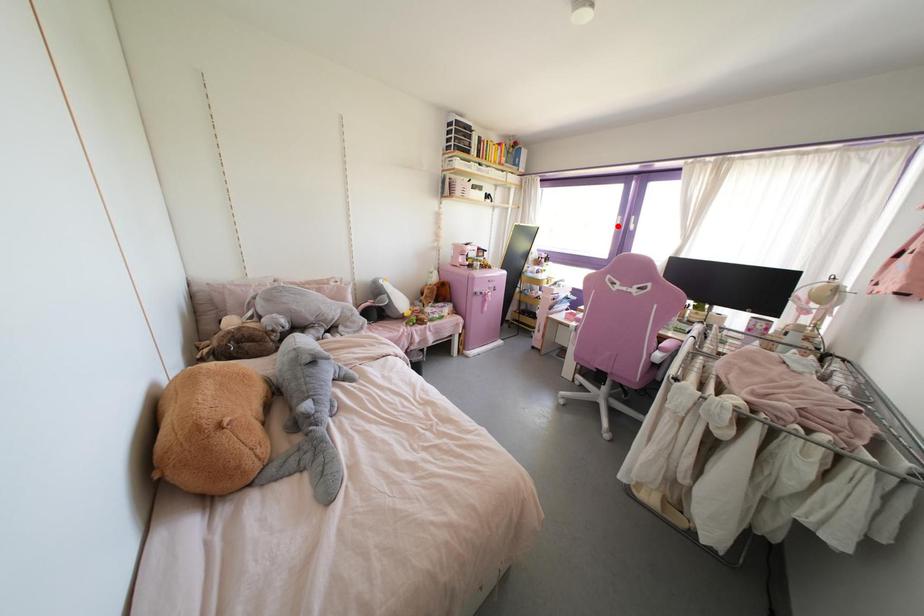
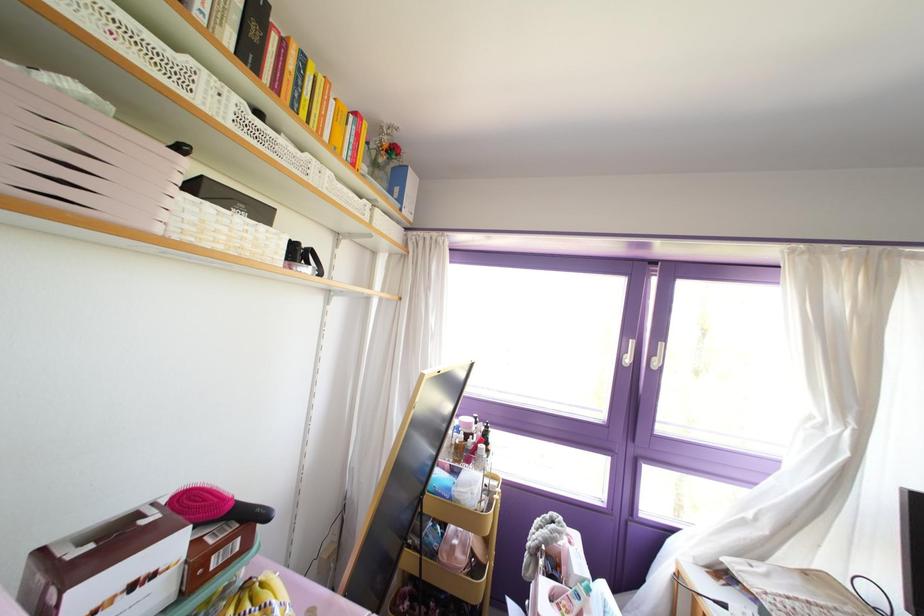
Question: I am providing you with two images of the same scene from different viewpoints. Image1 has a red point marked. In image2, the corresponding 3D location appears at what relative position? Reply with the corresponding letter.

Choices:
 (A) Closer
 (B) Farther

Answer: (B)